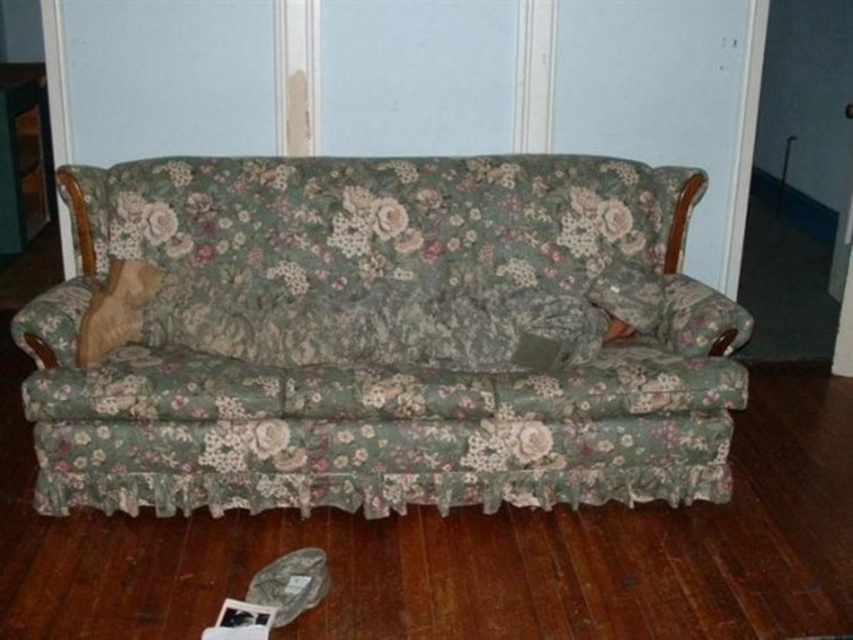
You are arranging a living room and need to place a new lamp between the floral fabric couch at center and the floral fabric pillow at center. Which side of the couch should the lamp be placed on to be between them?

The lamp should be placed on the right side of the floral fabric couch at center because the couch is positioned to the left of the pillow, so placing the lamp to the right of the couch would place it between the two items.

You are trying to decide whether to place a new rectangular coffee table in front of the floral fabric couch at center. Considering the size of the wooden pillow at left, which is smaller than the couch, can you estimate if the coffee table will fit comfortably between the couch and the wall?

The floral fabric couch at center is larger than the wooden pillow at left. Since the wooden pillow at left is smaller, the coffee table should fit comfortably between the couch and the wall as there is enough space.